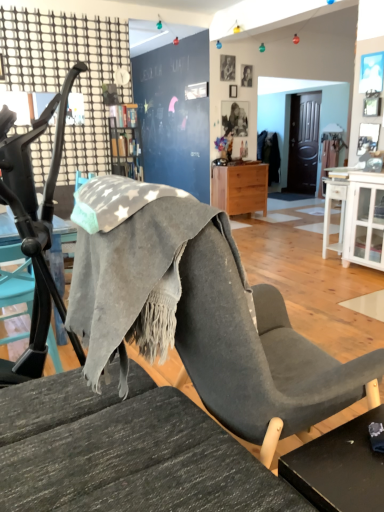
Question: Can you confirm if wooden bookshelf at upper center is wider than smooth skin portrait at upper center, the 1th person viewed from the back?

Choices:
 (A) yes
 (B) no

Answer: (A)

Question: Is wooden bookshelf at upper center surrounding smooth skin portrait at upper center, placed as the second person when sorted from front to back?

Choices:
 (A) no
 (B) yes

Answer: (A)

Question: From the image's perspective, is wooden bookshelf at upper center located above smooth skin portrait at upper center, placed as the second person when sorted from front to back?

Choices:
 (A) yes
 (B) no

Answer: (B)

Question: From a real-world perspective, is wooden bookshelf at upper center physically above smooth skin portrait at upper center, the second person viewed from the left?

Choices:
 (A) no
 (B) yes

Answer: (A)

Question: Is wooden bookshelf at upper center not near smooth skin portrait at upper center, the 1th person viewed from the back?

Choices:
 (A) yes
 (B) no

Answer: (A)

Question: Does wooden bookshelf at upper center have a lesser width compared to smooth skin portrait at upper center, placed as the second person when sorted from front to back?

Choices:
 (A) yes
 (B) no

Answer: (B)

Question: Can you confirm if smooth gray portrait at upper center, placed as the 2th person when sorted from back to front, is bigger than gray fabric chair at left?

Choices:
 (A) yes
 (B) no

Answer: (B)

Question: Considering the relative sizes of smooth gray portrait at upper center, placed as the 2th person when sorted from back to front, and gray fabric chair at left in the image provided, is smooth gray portrait at upper center, placed as the 2th person when sorted from back to front, thinner than gray fabric chair at left?

Choices:
 (A) yes
 (B) no

Answer: (A)

Question: Could you tell me if smooth gray portrait at upper center, which is counted as the first person, starting from the left, is turned towards gray fabric chair at left?

Choices:
 (A) no
 (B) yes

Answer: (A)

Question: From the image's perspective, is smooth gray portrait at upper center, which is counted as the first person, starting from the left, under gray fabric chair at left?

Choices:
 (A) yes
 (B) no

Answer: (B)

Question: Is the position of smooth gray portrait at upper center, which is counted as the first person, starting from the left, more distant than that of gray fabric chair at left?

Choices:
 (A) no
 (B) yes

Answer: (B)

Question: Considering the relative positions of smooth gray portrait at upper center, which ranks as the 1th person in front-to-back order, and gray fabric chair at left in the image provided, is smooth gray portrait at upper center, which ranks as the 1th person in front-to-back order, to the left of gray fabric chair at left from the viewer's perspective?

Choices:
 (A) no
 (B) yes

Answer: (A)

Question: Would you say light wood/texture nightstand at center is outside gray fabric chair at left?

Choices:
 (A) no
 (B) yes

Answer: (B)